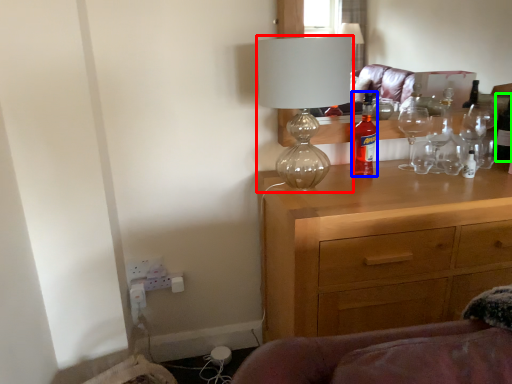
Question: Which is farther away from lamp (highlighted by a red box)? bottle (highlighted by a blue box) or bottle (highlighted by a green box)?

Choices:
 (A) bottle
 (B) bottle

Answer: (B)